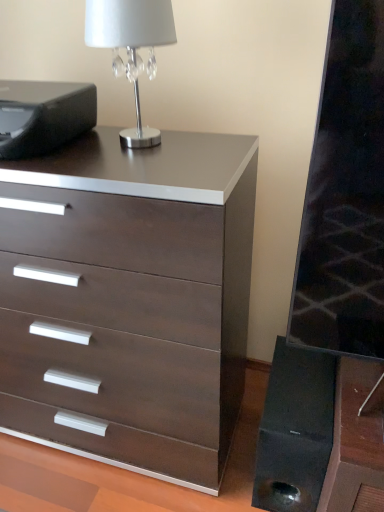
Question: Is silver metallic table lamp at upper left situated inside black matte speaker at lower right or outside?

Choices:
 (A) inside
 (B) outside

Answer: (B)

Question: In terms of width, does silver metallic table lamp at upper left look wider or thinner when compared to black matte speaker at lower right?

Choices:
 (A) thin
 (B) wide

Answer: (A)

Question: Which of these objects is positioned farthest from the black matte speaker at lower right?

Choices:
 (A) silver metallic table lamp at upper left
 (B) black matte printer at upper left
 (C) dark wood/matte chest of drawers at center

Answer: (A)

Question: Which is farther from the dark wood/matte chest of drawers at center?

Choices:
 (A) black matte printer at upper left
 (B) black matte speaker at lower right
 (C) silver metallic table lamp at upper left

Answer: (C)